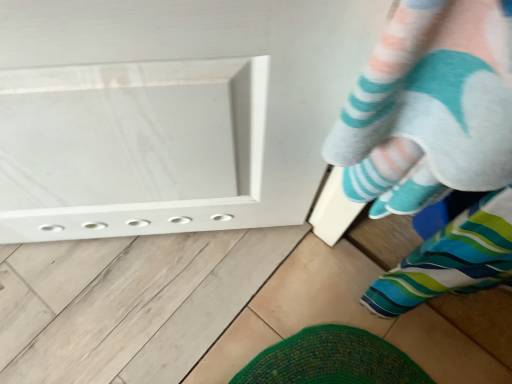
What do you see at coordinates (435, 144) in the screenshot? I see `striped socks at lower right` at bounding box center [435, 144].

The width and height of the screenshot is (512, 384). In order to click on striped socks at lower right in this screenshot , I will do `click(435, 144)`.

Describe the element at coordinates (332, 360) in the screenshot. I see `striped fabric sock at lower right` at that location.

Find the location of a particular element. The height and width of the screenshot is (384, 512). striped fabric sock at lower right is located at coordinates (332, 360).

Image resolution: width=512 pixels, height=384 pixels. What are the coordinates of `striped socks at lower right` in the screenshot? It's located at (435, 144).

In the scene shown: Considering the positions of objects striped fabric sock at lower right and striped socks at lower right in the image provided, who is more to the left, striped fabric sock at lower right or striped socks at lower right?

striped socks at lower right is more to the left.

Who is more distant, striped fabric sock at lower right or striped socks at lower right?

striped fabric sock at lower right is further from the camera.

Which point is more distant from viewer, (302, 357) or (452, 285)?

The point (302, 357) is more distant.

Consider the image. From the image's perspective, which object appears higher, striped fabric sock at lower right or striped socks at lower right?

striped socks at lower right appears higher in the image.

From a real-world perspective, which is physically below, striped fabric sock at lower right or striped socks at lower right?

In real-world perspective, striped fabric sock at lower right is lower.

Between striped fabric sock at lower right and striped socks at lower right, which one has larger width?

striped fabric sock at lower right is wider.

Between striped fabric sock at lower right and striped socks at lower right, which one has more height?

Standing taller between the two is striped socks at lower right.

Can you confirm if striped fabric sock at lower right is bigger than striped socks at lower right?

No, striped fabric sock at lower right is not bigger than striped socks at lower right.

In the scene shown: Is striped socks at lower right inside striped fabric sock at lower right?

No, striped socks at lower right is not a part of striped fabric sock at lower right.

Can you see striped fabric sock at lower right touching striped socks at lower right?

No, striped fabric sock at lower right is not next to striped socks at lower right.

Is striped fabric sock at lower right aimed at striped socks at lower right?

No, striped fabric sock at lower right is not facing towards striped socks at lower right.

How different are the orientations of striped fabric sock at lower right and striped socks at lower right in degrees?

striped fabric sock at lower right and striped socks at lower right are facing 90 degrees away from each other.

How distant is striped fabric sock at lower right from striped socks at lower right?

striped fabric sock at lower right is 17.05 inches from striped socks at lower right.

Image resolution: width=512 pixels, height=384 pixels. In order to click on footwear on the right of striped socks at lower right in this screenshot , I will do `click(332, 360)`.

Is striped socks at lower right at the left side of striped fabric sock at lower right?

Yes.

In the image, is striped socks at lower right positioned in front of or behind striped fabric sock at lower right?

Clearly, striped socks at lower right is in front of striped fabric sock at lower right.

Between point (419, 272) and point (378, 354), which one is positioned behind?

The point (378, 354) is behind.

Looking at this image, from the image's perspective, is striped socks at lower right beneath striped fabric sock at lower right?

No.

From a real-world perspective, is striped socks at lower right on striped fabric sock at lower right?

Yes, from a real-world perspective, striped socks at lower right is over striped fabric sock at lower right

Between striped socks at lower right and striped fabric sock at lower right, which one has larger width?

With larger width is striped fabric sock at lower right.

Considering the sizes of striped socks at lower right and striped fabric sock at lower right in the image, is striped socks at lower right taller or shorter than striped fabric sock at lower right?

Clearly, striped socks at lower right is taller compared to striped fabric sock at lower right.

From the picture: Who is smaller, striped socks at lower right or striped fabric sock at lower right?

striped fabric sock at lower right.

Could striped fabric sock at lower right be considered to be inside striped socks at lower right?

Actually, striped fabric sock at lower right is outside striped socks at lower right.

Are striped socks at lower right and striped fabric sock at lower right beside each other?

No, striped socks at lower right is not next to striped fabric sock at lower right.

Is striped socks at lower right facing towards striped fabric sock at lower right?

Yes, striped socks at lower right is aimed at striped fabric sock at lower right.

How different are the orientations of striped socks at lower right and striped fabric sock at lower right in degrees?

The angular difference between striped socks at lower right and striped fabric sock at lower right is 90 degrees.

Image resolution: width=512 pixels, height=384 pixels. I want to click on footwear behind the striped socks at lower right, so point(332,360).

The width and height of the screenshot is (512, 384). Identify the location of footwear behind the striped socks at lower right. 332,360.

The width and height of the screenshot is (512, 384). I want to click on person above the striped fabric sock at lower right (from the image's perspective), so click(435, 144).